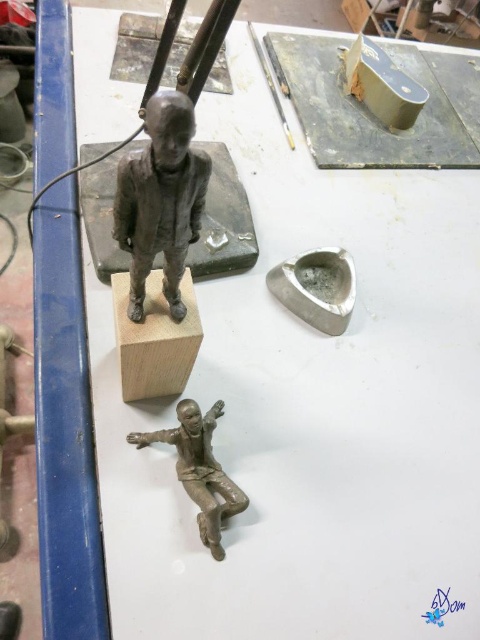
Question: Which object appears closest to the camera in this image?

Choices:
 (A) matte bronze figure at lower center
 (B) bronze statue at center

Answer: (B)

Question: Where is bronze statue at center located in relation to matte bronze figure at lower center in the image?

Choices:
 (A) above
 (B) below

Answer: (A)

Question: Is bronze statue at center thinner than matte bronze figure at lower center?

Choices:
 (A) yes
 (B) no

Answer: (A)

Question: Which object appears farthest from the camera in this image?

Choices:
 (A) matte bronze figure at lower center
 (B) bronze statue at center

Answer: (A)

Question: Is bronze statue at center further to camera compared to matte bronze figure at lower center?

Choices:
 (A) yes
 (B) no

Answer: (B)

Question: Which of the following is the farthest from the observer?

Choices:
 (A) (124, 189)
 (B) (163, 435)

Answer: (B)